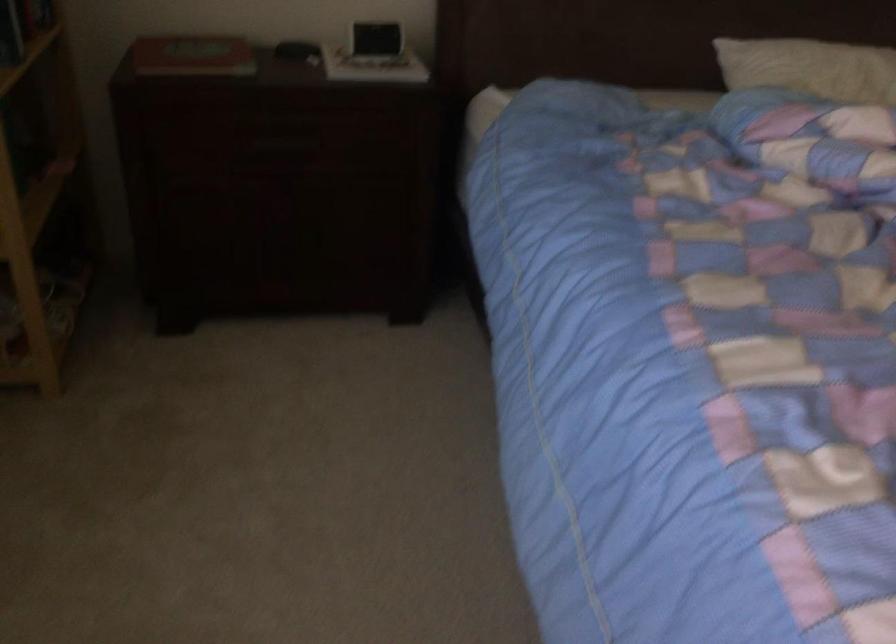
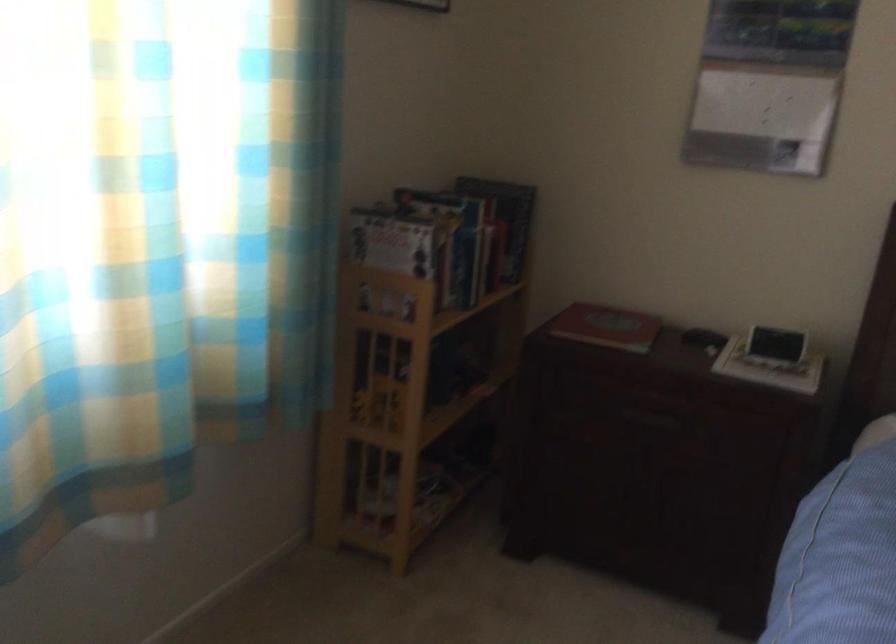
Locate, in the second image, the point that corresponds to point 287,142 in the first image.

(652, 415)